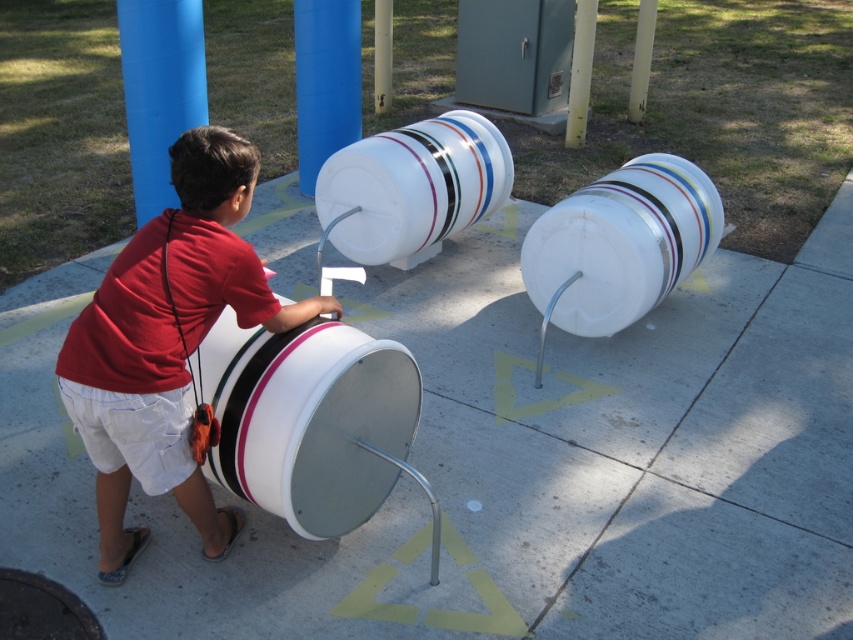
You are a delivery robot with a height of 1.2 meters. You need to deliver a package to the location where the matte red shirt at center is located. The white concrete pavement at center is the path you must take. Is your height sufficient to avoid hitting your head on any obstacles while moving along the path?

The distance between the white concrete pavement at center and the matte red shirt at center is 1.09 meters. Since the robot is 1.2 meters tall, it is 0.11 meters taller than the available space, so it may hit its head on obstacles.

You are designing a map of the playground and need to place the white plastic barrel at center. According to the coordinates provided, where should it be positioned?

The white plastic barrel at center should be positioned at coordinates point (619, 243).